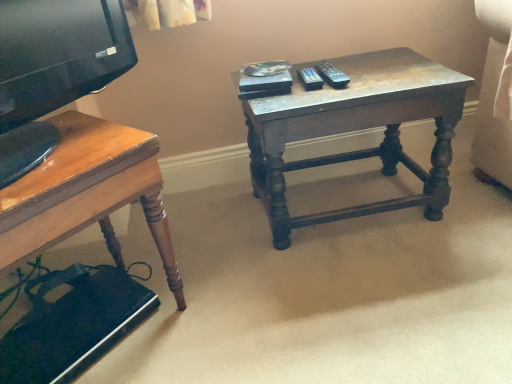
This screenshot has height=384, width=512. Find the location of `free spot above wooden desk at lower left (from a real-world perspective)`. free spot above wooden desk at lower left (from a real-world perspective) is located at coordinates (63, 148).